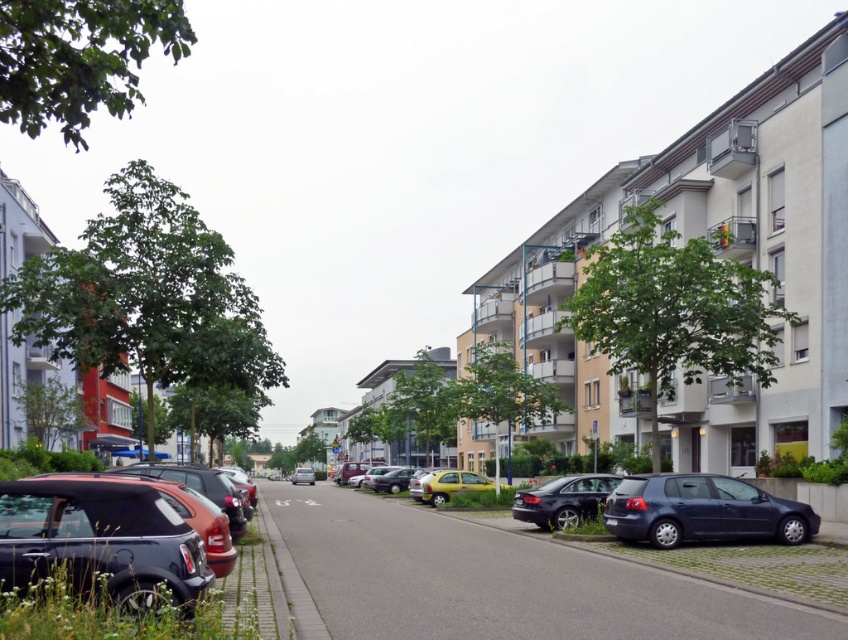
What are the coordinates of the shiny black sedan at center in the image?

The coordinates of the shiny black sedan at center are at point (562, 500).